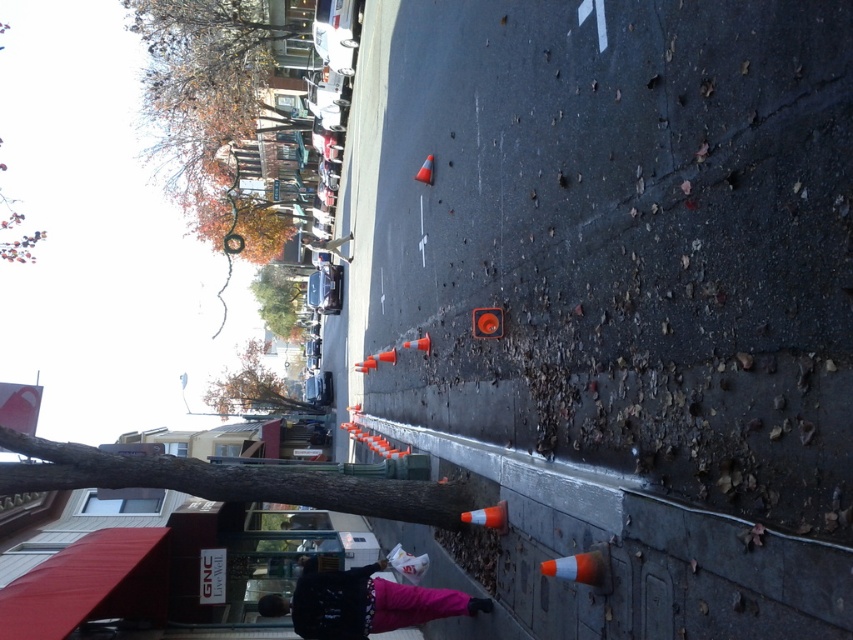
Describe the element at coordinates (254, 387) in the screenshot. This screenshot has height=640, width=853. I see `brown leafy tree at upper center` at that location.

Is point (227, 384) less distant than point (431, 180)?

No, (227, 384) is further to viewer.

Where is `brown leafy tree at upper center`? The width and height of the screenshot is (853, 640). brown leafy tree at upper center is located at coordinates (254, 387).

Does brown leafy tree at upper center appear over green leafy tree at upper center?

No.

Looking at this image, can you confirm if brown leafy tree at upper center is bigger than green leafy tree at upper center?

Correct, brown leafy tree at upper center is larger in size than green leafy tree at upper center.

Which is behind, point (247, 355) or point (259, 314)?

The point (259, 314) is more distant.

The width and height of the screenshot is (853, 640). What are the coordinates of `brown leafy tree at upper center` in the screenshot? It's located at (254, 387).

Between green leafy tree at upper center and orange reflective cone at lower center, which one appears on the left side from the viewer's perspective?

From the viewer's perspective, green leafy tree at upper center appears more on the left side.

Is green leafy tree at upper center taller than orange reflective cone at lower center?

Yes.

At what (x,y) coordinates should I click in order to perform the action: click on green leafy tree at upper center. Please return your answer as a coordinate pair (x, y). This screenshot has height=640, width=853. Looking at the image, I should click on click(277, 300).